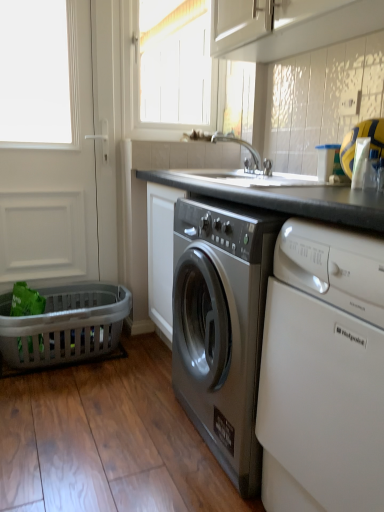
The height and width of the screenshot is (512, 384). Identify the location of vacant area in front of gray plastic laundry basket at lower left. (69, 407).